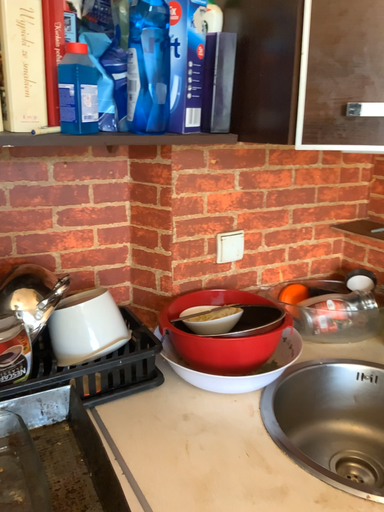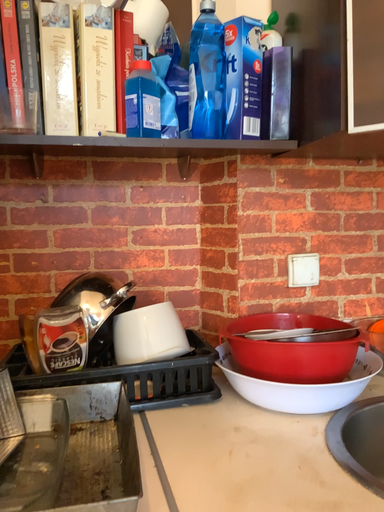
Question: Which way did the camera rotate in the video?

Choices:
 (A) rotated downward
 (B) rotated upward

Answer: (B)